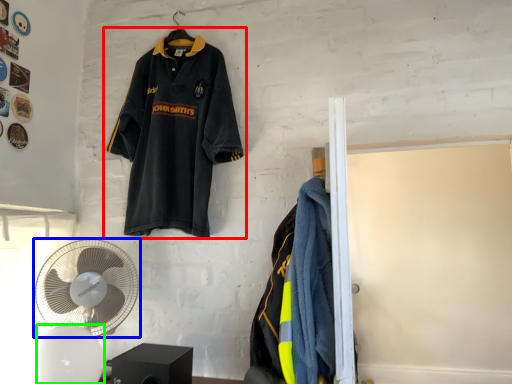
Question: Which object is positioned farthest from sports uniform (highlighted by a red box)? Select from mechanical fan (highlighted by a blue box) and mechanical fan (highlighted by a green box).

Choices:
 (A) mechanical fan
 (B) mechanical fan

Answer: (B)